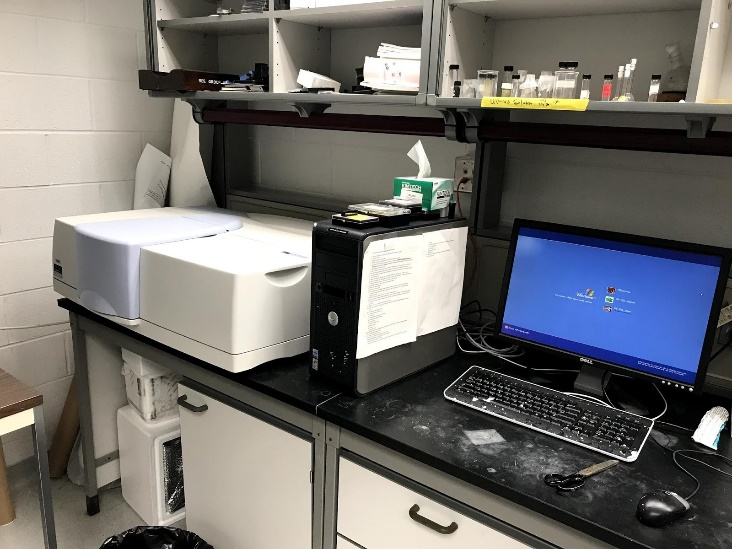
You are a GUI agent. You are given a task and a screenshot of the screen. Output one action in this format:
    pyautogui.click(x=<x>, y=<y>)
    Task: Click on the drawer
    This screenshot has height=549, width=732.
    Given the screenshot: What is the action you would take?
    pyautogui.click(x=354, y=505), pyautogui.click(x=340, y=543)